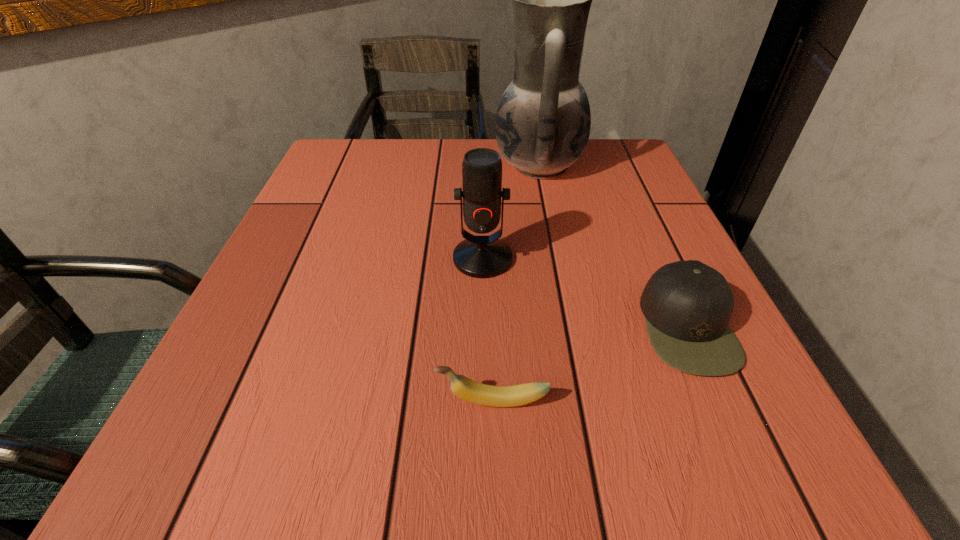
The height and width of the screenshot is (540, 960). I want to click on vacant space that satisfies the following two spatial constraints: 1. on the front-facing side of the pitcher; 2. on the side of the second farthest object with the red ring, so click(557, 259).